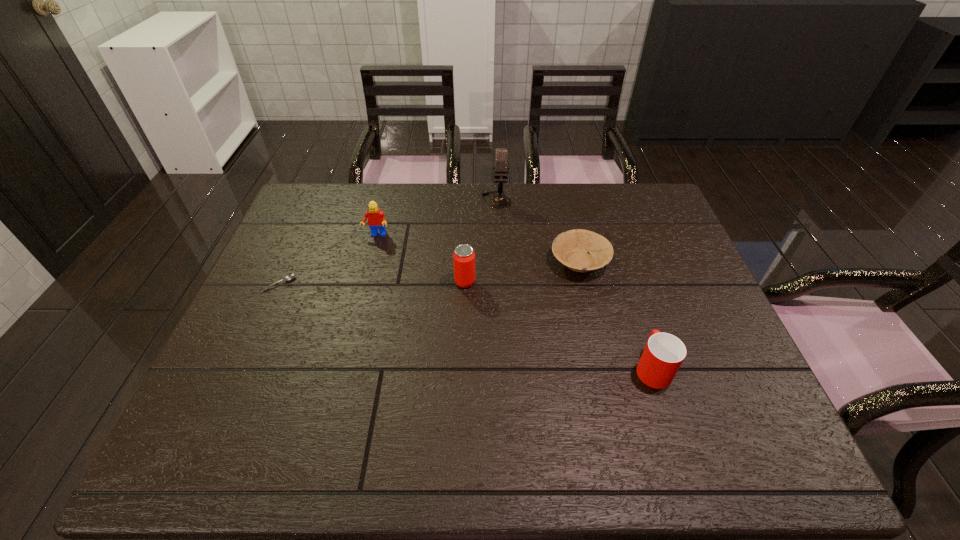
Where is `blank region between the fifth nearest object and the fifth tallest object`? blank region between the fifth nearest object and the fifth tallest object is located at coordinates (478, 248).

Where is `free space that is in between the third object from left to right and the leftmost object`? free space that is in between the third object from left to right and the leftmost object is located at coordinates (372, 283).

Identify the location of free space between the beer can and the farthest object. Image resolution: width=960 pixels, height=540 pixels. (481, 241).

Locate an element on the screen. The image size is (960, 540). free space that is in between the second object from left to right and the tallest object is located at coordinates (437, 218).

Find the location of a particular element. The width and height of the screenshot is (960, 540). vacant space that is in between the leftmost object and the fifth tallest object is located at coordinates (429, 273).

Select which object appears as the closest to the cup. Please provide its 2D coordinates. Your answer should be formatted as a tuple, i.e. [(x, y)], where the tuple contains the x and y coordinates of a point satisfying the conditions above.

[(571, 248)]

Choose which object is the fourth nearest neighbor to the leftmost object. Please provide its 2D coordinates. Your answer should be formatted as a tuple, i.e. [(x, y)], where the tuple contains the x and y coordinates of a point satisfying the conditions above.

[(571, 248)]

This screenshot has height=540, width=960. What are the coordinates of `free point that satisfies the following two spatial constraints: 1. on the front-facing side of the tallest object; 2. on the right side of the fifth tallest object` in the screenshot? It's located at (499, 261).

Where is `free space that satisfies the following two spatial constraints: 1. on the front-facing side of the Lego; 2. on the left side of the third object from left to right`? This screenshot has width=960, height=540. free space that satisfies the following two spatial constraints: 1. on the front-facing side of the Lego; 2. on the left side of the third object from left to right is located at coordinates tap(365, 282).

Find the location of a particular element. The image size is (960, 540). free location that satisfies the following two spatial constraints: 1. on the front-facing side of the fifth tallest object; 2. on the left side of the second object from left to right is located at coordinates point(370,261).